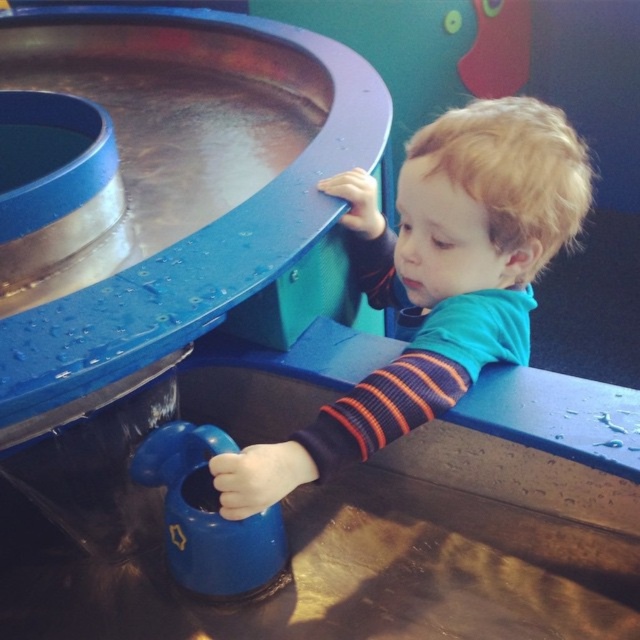
Is blue matte shirt at upper right shorter than blue rubber toy at lower center?

Incorrect, blue matte shirt at upper right's height does not fall short of blue rubber toy at lower center's.

Can you confirm if blue matte shirt at upper right is smaller than blue rubber toy at lower center?

No, blue matte shirt at upper right is not smaller than blue rubber toy at lower center.

Between point (348, 417) and point (220, 448), which one is positioned in front?

Point (348, 417)

What are the coordinates of `blue matte shirt at upper right` in the screenshot? It's located at (436, 280).